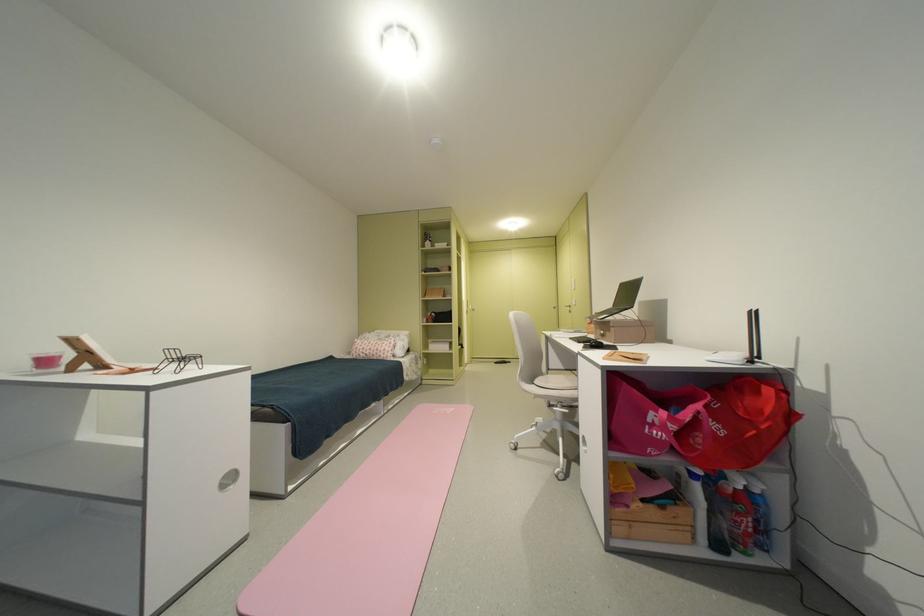
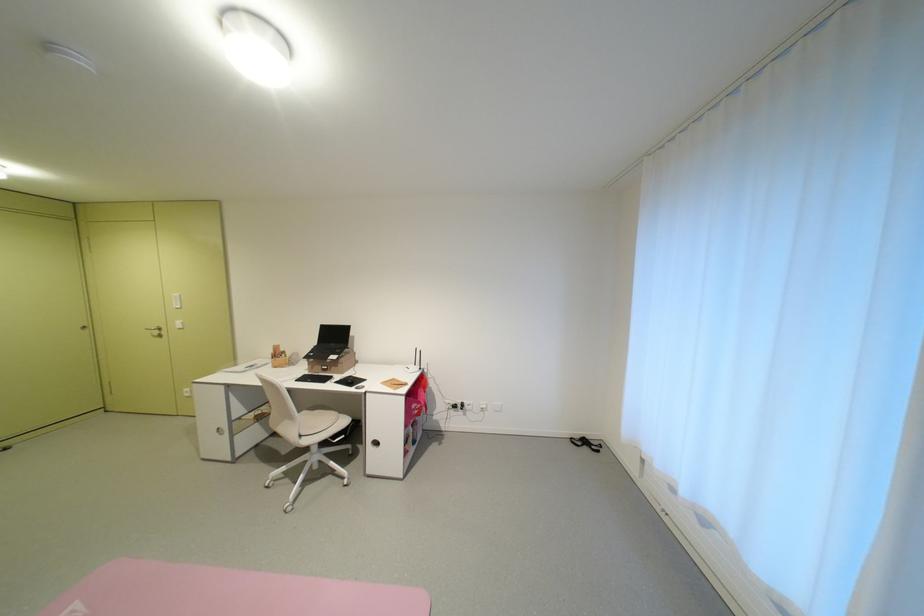
Locate, in the second image, the point that corresponds to point 543,383 in the first image.

(311, 436)